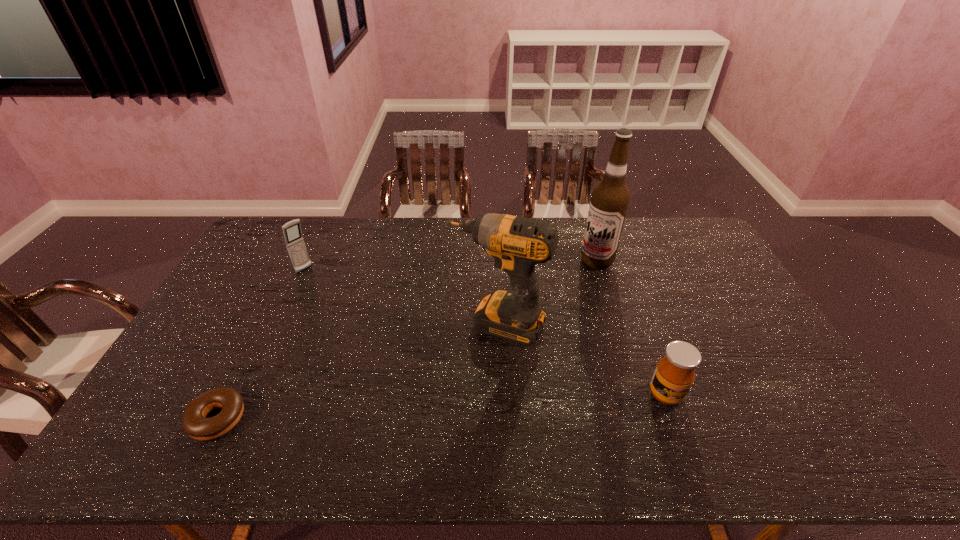
At what (x,y) coordinates should I click in order to perform the action: click on free space on the desktop that is between the shortest object and the honey and is positioned on the front-facing side of the third shortest object. Please return your answer as a coordinate pair (x, y). This screenshot has width=960, height=540. Looking at the image, I should click on (468, 405).

This screenshot has width=960, height=540. I want to click on free space on the desktop that is between the doughnut and the fourth tallest object and is positioned with the drill bit of the third farthest object facing forward, so click(x=457, y=406).

The image size is (960, 540). Find the location of `vacant space on the desktop that is between the shortest object and the second shortest object and is positioned on the label of the tallest object`. vacant space on the desktop that is between the shortest object and the second shortest object and is positioned on the label of the tallest object is located at coordinates (438, 407).